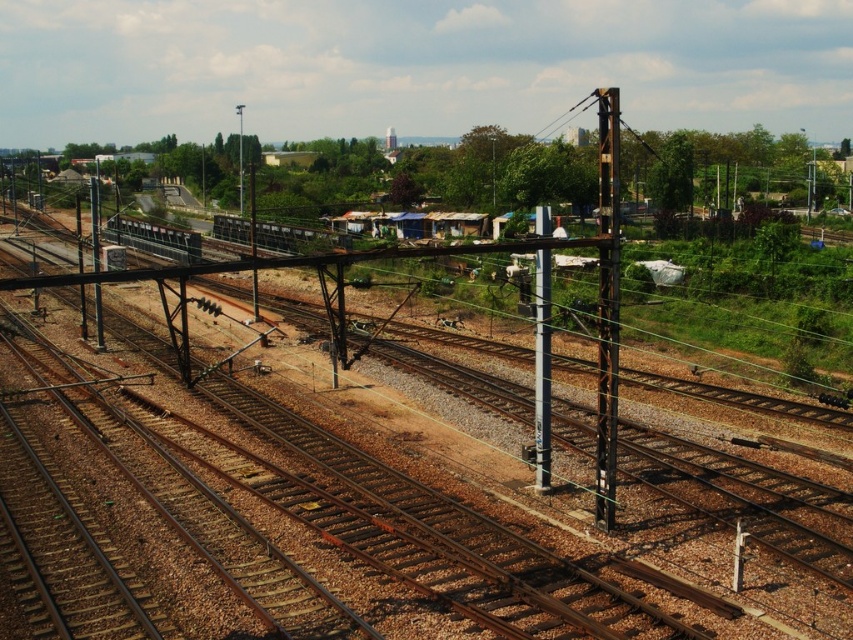
Consider the image. Can you confirm if black metallic pole at center-right is smaller than metallic pole at left?

Indeed, black metallic pole at center-right has a smaller size compared to metallic pole at left.

Where is `black metallic pole at center-right`? black metallic pole at center-right is located at coordinates (543, 371).

Does metallic pole at center have a larger size compared to metallic pole at upper center?

Indeed, metallic pole at center has a larger size compared to metallic pole at upper center.

Which is in front, point (253, 230) or point (242, 170)?

Point (253, 230) is in front.

The width and height of the screenshot is (853, 640). In order to click on metallic pole at center in this screenshot , I will do `click(251, 209)`.

Who is more forward, (x=299, y=252) or (x=187, y=250)?

Point (x=299, y=252) is in front.

Can you confirm if metallic gray train at center is positioned to the right of shiny silver train at left?

Indeed, metallic gray train at center is positioned on the right side of shiny silver train at left.

Describe the element at coordinates (294, 237) in the screenshot. I see `metallic gray train at center` at that location.

Where is `metallic gray train at center`? metallic gray train at center is located at coordinates (294, 237).